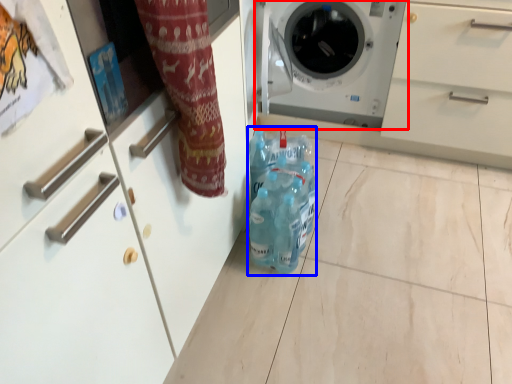
Question: Which object is further to the camera taking this photo, washing machine (highlighted by a red box) or cleaning product (highlighted by a blue box)?

Choices:
 (A) washing machine
 (B) cleaning product

Answer: (A)